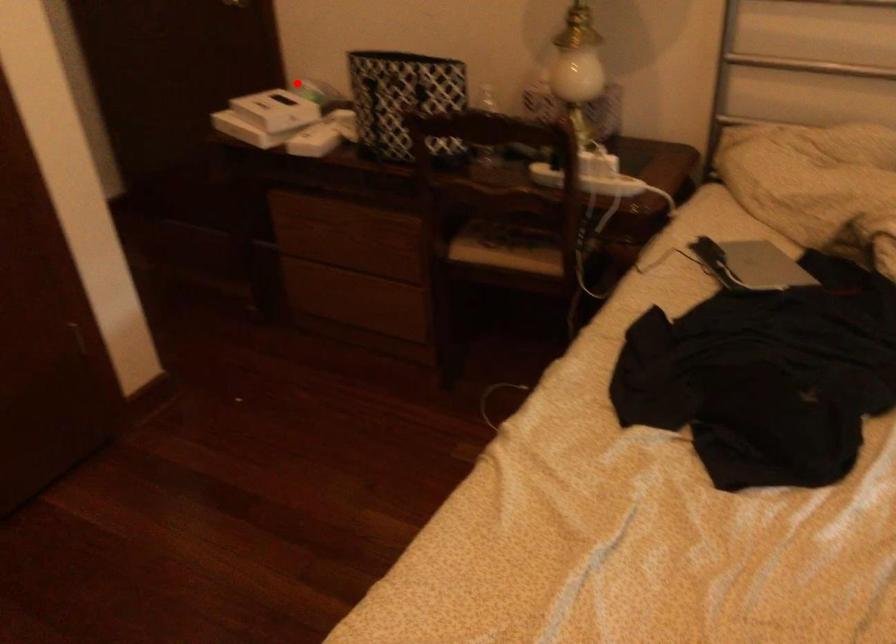
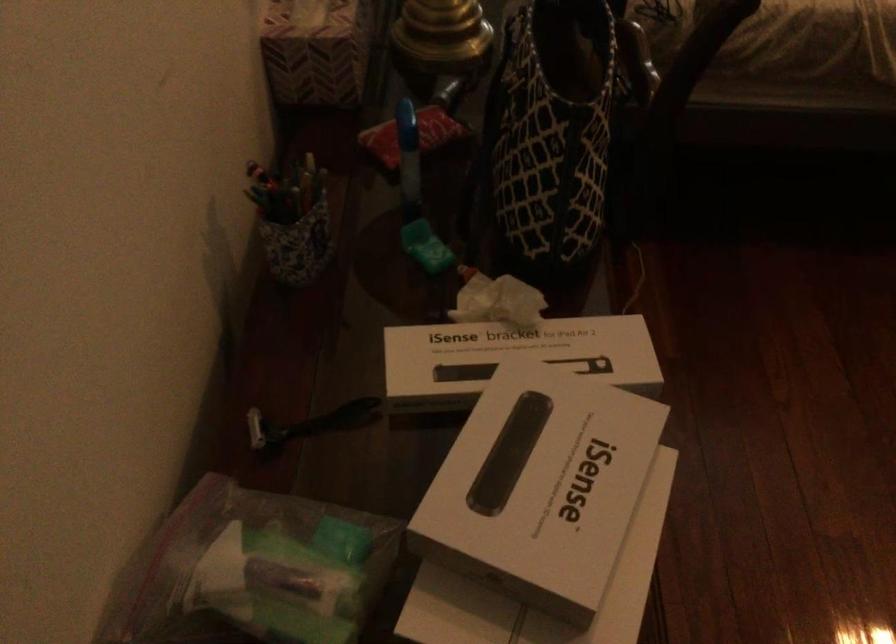
Question: I am providing you with two images of the same scene from different viewpoints. In image1, a red point is highlighted. Considering the same 3D point in image2, which of the following is correct?

Choices:
 (A) It is closer
 (B) It is farther

Answer: (A)